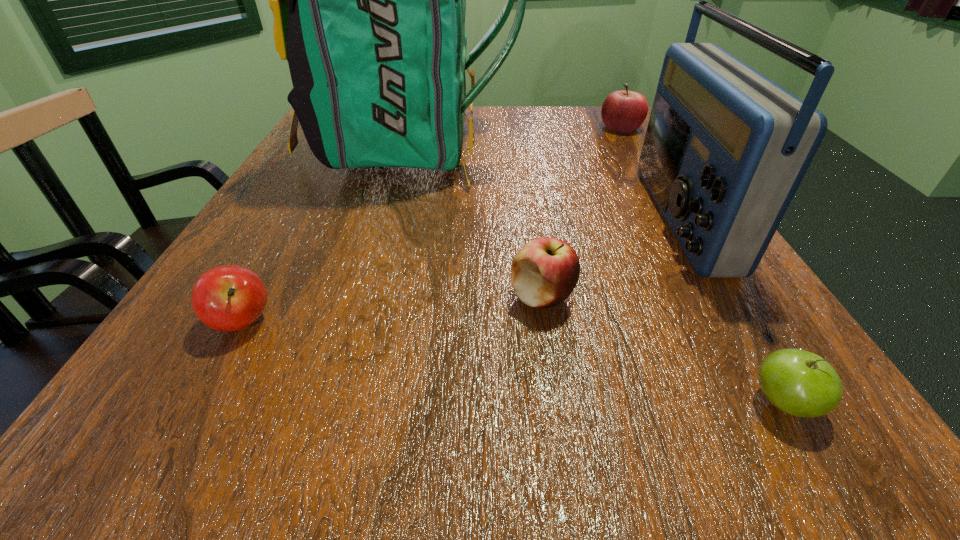
Where is `object positioned at the far left corner`? object positioned at the far left corner is located at coordinates (369, 0).

The height and width of the screenshot is (540, 960). What are the coordinates of `object situated at the far right corner` in the screenshot? It's located at (624, 111).

This screenshot has height=540, width=960. I want to click on object that is positioned at the near right corner, so click(x=800, y=383).

In the image, there is a desktop. Where is `vacant space at the far edge`? The height and width of the screenshot is (540, 960). vacant space at the far edge is located at coordinates (509, 109).

Identify the location of vacant space at the near edge of the desktop. The height and width of the screenshot is (540, 960). (305, 457).

Identify the location of vacant space at the left edge. Image resolution: width=960 pixels, height=540 pixels. (301, 250).

This screenshot has width=960, height=540. I want to click on free space at the right edge, so click(752, 357).

Locate an element on the screen. This screenshot has width=960, height=540. vacant area at the near left corner of the desktop is located at coordinates (247, 429).

The image size is (960, 540). Identify the location of free space between the second apple from left to right and the tallest object. (476, 221).

Image resolution: width=960 pixels, height=540 pixels. In order to click on empty space between the radio receiver and the nearest apple in this screenshot , I will do `click(732, 310)`.